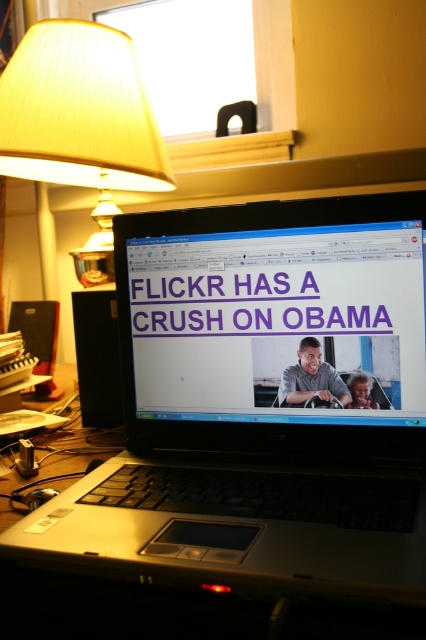
Question: In this image, where is matte black laptop at center located relative to matte plastic steering wheel at center?

Choices:
 (A) left
 (B) right

Answer: (A)

Question: Which of the following is the closest to the observer?

Choices:
 (A) (129, 337)
 (B) (138, 67)
 (C) (284, 388)

Answer: (C)

Question: Observing the image, what is the correct spatial positioning of matte black laptop at center in reference to yellow pleated fabric lampshade at upper left?

Choices:
 (A) above
 (B) below

Answer: (B)

Question: Which object is farther from the camera taking this photo?

Choices:
 (A) matte plastic steering wheel at center
 (B) matte black laptop at center
 (C) yellow pleated fabric lampshade at upper left
 (D) silver/black plastic laptop at center

Answer: (C)

Question: Among these points, which one is farthest from the camera?

Choices:
 (A) (123, 122)
 (B) (293, 401)
 (C) (403, 349)

Answer: (A)

Question: Does silver/black plastic laptop at center appear over matte black laptop at center?

Choices:
 (A) yes
 (B) no

Answer: (B)